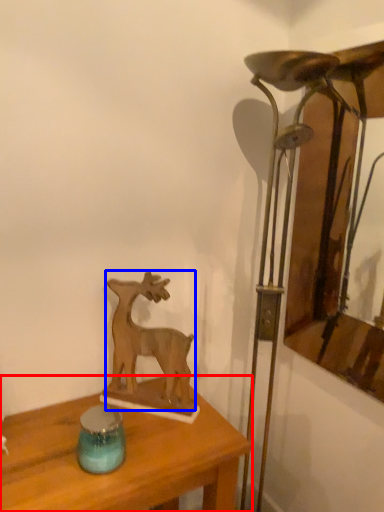
Question: Among these objects, which one is farthest to the camera, table (highlighted by a red box) or deer (highlighted by a blue box)?

Choices:
 (A) table
 (B) deer

Answer: (B)